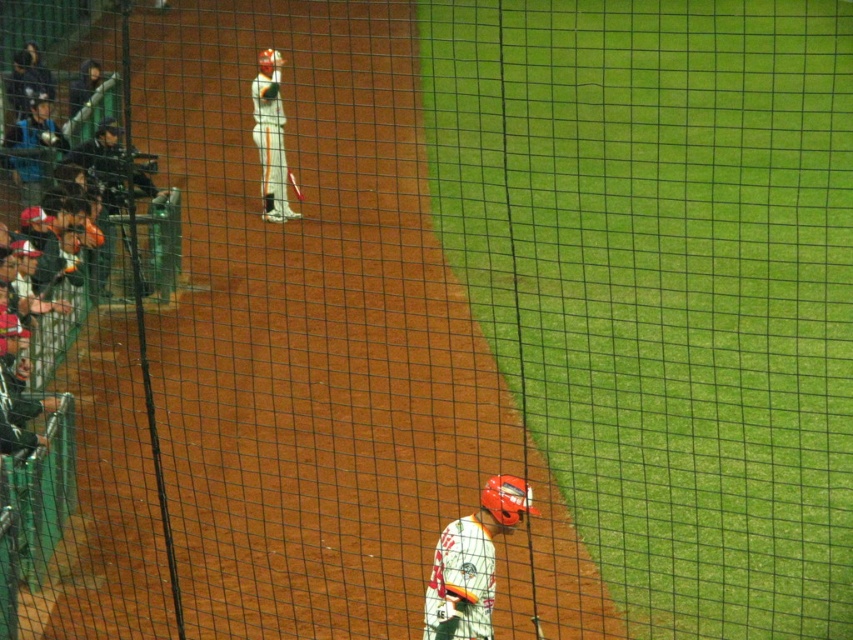
Question: Does white jersey at lower center appear on the left side of white matte uniform at center?

Choices:
 (A) no
 (B) yes

Answer: (A)

Question: Which object is positioned closest to the white matte uniform at center?

Choices:
 (A) white jersey at lower center
 (B) matte black helmet at left

Answer: (B)

Question: Can you confirm if white matte uniform at center is thinner than matte black helmet at left?

Choices:
 (A) no
 (B) yes

Answer: (B)

Question: Which point is closer to the camera?

Choices:
 (A) (517, 508)
 (B) (41, 161)

Answer: (A)

Question: Estimate the real-world distances between objects in this image. Which object is farther from the matte black helmet at left?

Choices:
 (A) white matte uniform at center
 (B) white jersey at lower center

Answer: (B)

Question: Does white matte uniform at center have a larger size compared to matte black helmet at left?

Choices:
 (A) no
 (B) yes

Answer: (A)